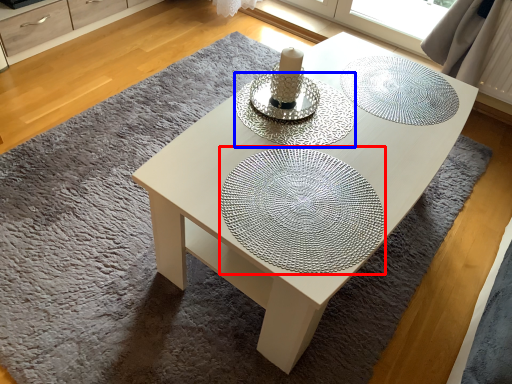
Question: Which of the following is the closest to the observer, glass plate (highlighted by a red box) or glass plate (highlighted by a blue box)?

Choices:
 (A) glass plate
 (B) glass plate

Answer: (A)